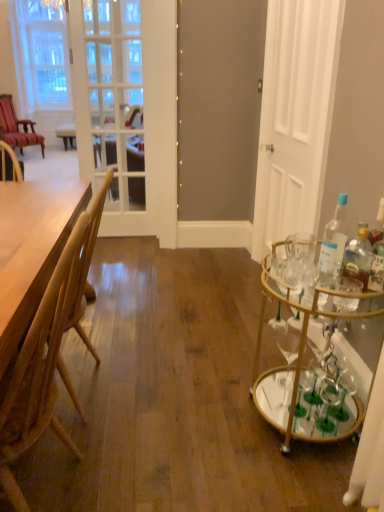
Question: In terms of width, does light brown wood chair at left, marked as the 2th chair in a left-to-right arrangement, look wider or thinner when compared to clear glass bottle at right, acting as the second bottle starting from the left?

Choices:
 (A) wide
 (B) thin

Answer: (A)

Question: Considering the relative positions of light brown wood chair at left, marked as the 2th chair in a left-to-right arrangement, and clear glass bottle at right, acting as the second bottle starting from the left, in the image provided, is light brown wood chair at left, marked as the 2th chair in a left-to-right arrangement, to the left or to the right of clear glass bottle at right, acting as the second bottle starting from the left,?

Choices:
 (A) right
 (B) left

Answer: (B)

Question: Which is nearer to the clear glass bottle at right, arranged as the 2th bottle when viewed from the right?

Choices:
 (A) wooden table at left
 (B) white matte door at right
 (C) clear glass bottle at right, acting as the second bottle starting from the left
 (D) light brown wood chair at left, which appears as the second chair when viewed from the top
 (E) white glass screen door at upper left

Answer: (C)

Question: Considering the real-world distances, which object is closest to the wooden table at left?

Choices:
 (A) white matte door at right
 (B) clear glass bottle at right, acting as the second bottle starting from the left
 (C) clear glass bottle at right, arranged as the 2th bottle when viewed from the right
 (D) white glass screen door at upper left
 (E) light brown wood chair at left, which appears as the second chair when viewed from the top

Answer: (E)